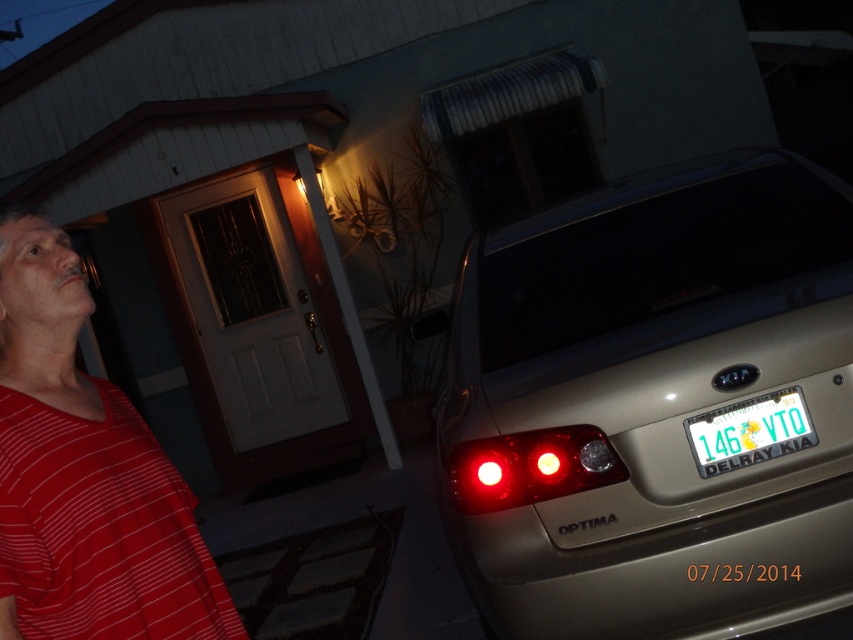
Question: Is green metallic license plate at center-right further to the viewer compared to red glass light at center?

Choices:
 (A) yes
 (B) no

Answer: (B)

Question: Can you confirm if red striped shirt at left is wider than red translucent light at center?

Choices:
 (A) yes
 (B) no

Answer: (A)

Question: Which point is closer to the camera taking this photo?

Choices:
 (A) (712, 428)
 (B) (541, 468)
 (C) (99, 483)

Answer: (C)

Question: Which point is closer to the camera?

Choices:
 (A) (552, 454)
 (B) (532, 460)
 (C) (70, 422)

Answer: (C)

Question: Which point appears farthest from the camera in this image?

Choices:
 (A) (544, 458)
 (B) (807, 436)

Answer: (A)

Question: Is matte plastic brake light at lower right positioned behind green metallic license plate at center-right?

Choices:
 (A) no
 (B) yes

Answer: (B)